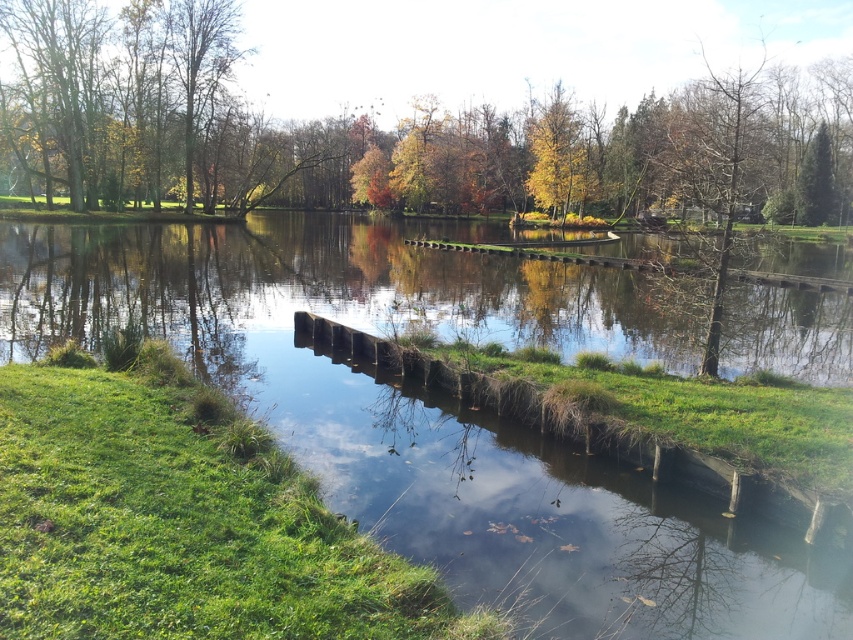
Question: Does green leafy tree at center come in front of yellow-green leaves at upper center?

Choices:
 (A) yes
 (B) no

Answer: (A)

Question: Which point is farther from the camera taking this photo?

Choices:
 (A) (379, 40)
 (B) (538, 156)

Answer: (A)

Question: Which point is farther from the camera taking this photo?

Choices:
 (A) (572, 102)
 (B) (699, 88)
 (C) (421, 468)
 (D) (355, 17)

Answer: (D)

Question: Which of the following is the farthest from the observer?

Choices:
 (A) (566, 180)
 (B) (815, 296)
 (C) (712, 307)

Answer: (A)

Question: Is green grassy river at center thinner than green leafy tree at center?

Choices:
 (A) yes
 (B) no

Answer: (A)

Question: Is bare branches at upper right further to the viewer compared to yellow-green leaves at upper center?

Choices:
 (A) yes
 (B) no

Answer: (B)